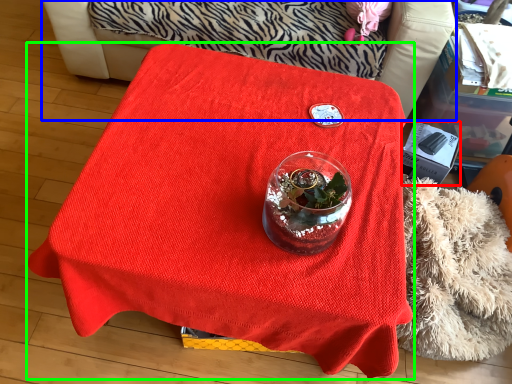
Question: Estimate the real-world distances between objects in this image. Which object is closer to box (highlighted by a red box), furniture (highlighted by a blue box) or table (highlighted by a green box)?

Choices:
 (A) furniture
 (B) table

Answer: (B)